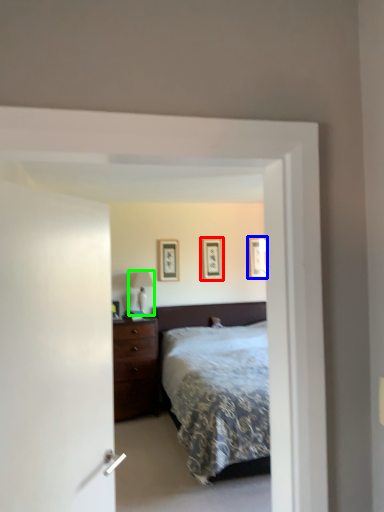
Question: Estimate the real-world distances between objects in this image. Which object is closer to picture frame (highlighted by a red box), picture frame (highlighted by a blue box) or table lamp (highlighted by a green box)?

Choices:
 (A) picture frame
 (B) table lamp

Answer: (A)